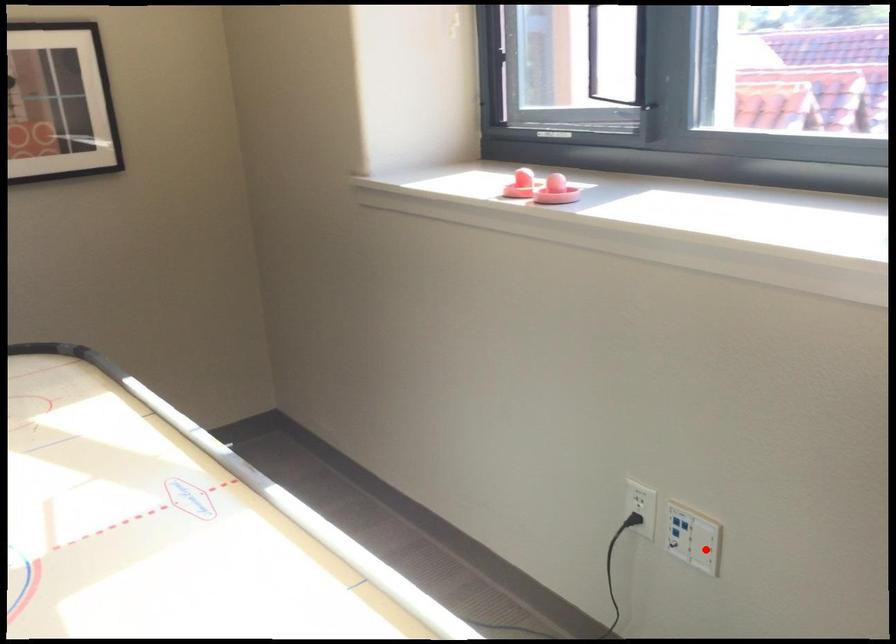
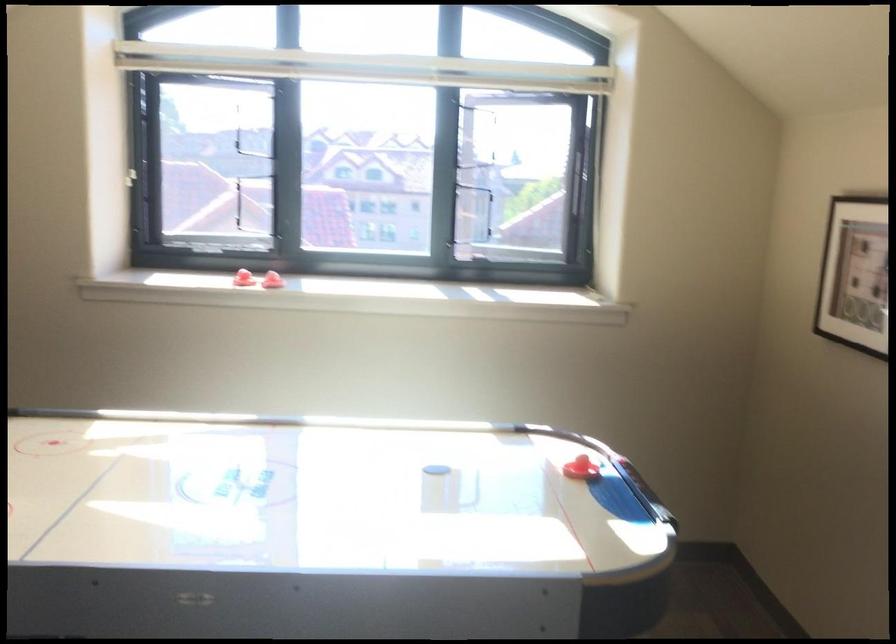
Question: I am providing you with two images of the same scene from different viewpoints. A red point is marked on the first image. At the location where the point appears in image 1, is it still visible in image 2?

Choices:
 (A) Yes
 (B) No

Answer: (B)